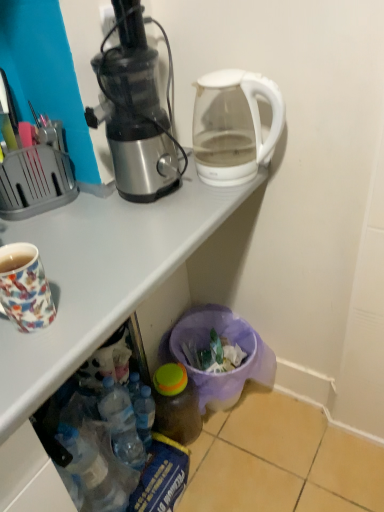
Question: Is white glossy desk at upper center touching translucent plastic bottle at lower center, placed as the 1th bottle when sorted from left to right?

Choices:
 (A) yes
 (B) no

Answer: (B)

Question: From a real-world perspective, is white glossy desk at upper center under translucent plastic bottle at lower center, placed as the 1th bottle when sorted from left to right?

Choices:
 (A) no
 (B) yes

Answer: (A)

Question: Does white glossy desk at upper center appear on the left side of translucent plastic bottle at lower center, the second bottle in the right-to-left sequence?

Choices:
 (A) no
 (B) yes

Answer: (B)

Question: Does white glossy desk at upper center have a greater width compared to translucent plastic bottle at lower center, the second bottle in the right-to-left sequence?

Choices:
 (A) no
 (B) yes

Answer: (B)

Question: From the image's perspective, is white glossy desk at upper center under translucent plastic bottle at lower center, placed as the 1th bottle when sorted from left to right?

Choices:
 (A) no
 (B) yes

Answer: (A)

Question: From a real-world perspective, relative to translucent plastic bottle at lower center, which ranks as the 2th bottle in left-to-right order, is multicolored ceramic mug at left vertically above or below?

Choices:
 (A) below
 (B) above

Answer: (B)

Question: Considering the positions of point (39, 266) and point (175, 438), is point (39, 266) closer or farther from the camera than point (175, 438)?

Choices:
 (A) closer
 (B) farther

Answer: (A)

Question: Considering the positions of multicolored ceramic mug at left and translucent plastic bottle at lower center, which ranks as the 2th bottle in left-to-right order, in the image, is multicolored ceramic mug at left taller or shorter than translucent plastic bottle at lower center, which ranks as the 2th bottle in left-to-right order,?

Choices:
 (A) short
 (B) tall

Answer: (A)

Question: From the image's perspective, is multicolored ceramic mug at left located above or below translucent plastic bottle at lower center, acting as the first bottle starting from the right?

Choices:
 (A) above
 (B) below

Answer: (A)

Question: From a real-world perspective, is transparent glass kettle at upper right positioned above or below white glossy desk at upper center?

Choices:
 (A) below
 (B) above

Answer: (B)

Question: Is point (200, 162) closer or farther from the camera than point (147, 283)?

Choices:
 (A) farther
 (B) closer

Answer: (A)

Question: Is transparent glass kettle at upper right to the left or to the right of white glossy desk at upper center in the image?

Choices:
 (A) right
 (B) left

Answer: (A)

Question: From their relative heights in the image, would you say transparent glass kettle at upper right is taller or shorter than white glossy desk at upper center?

Choices:
 (A) tall
 (B) short

Answer: (B)

Question: Is multicolored ceramic mug at left wider or thinner than metallic silver juicer at left?

Choices:
 (A) wide
 (B) thin

Answer: (B)

Question: In terms of size, does multicolored ceramic mug at left appear bigger or smaller than metallic silver juicer at left?

Choices:
 (A) small
 (B) big

Answer: (A)